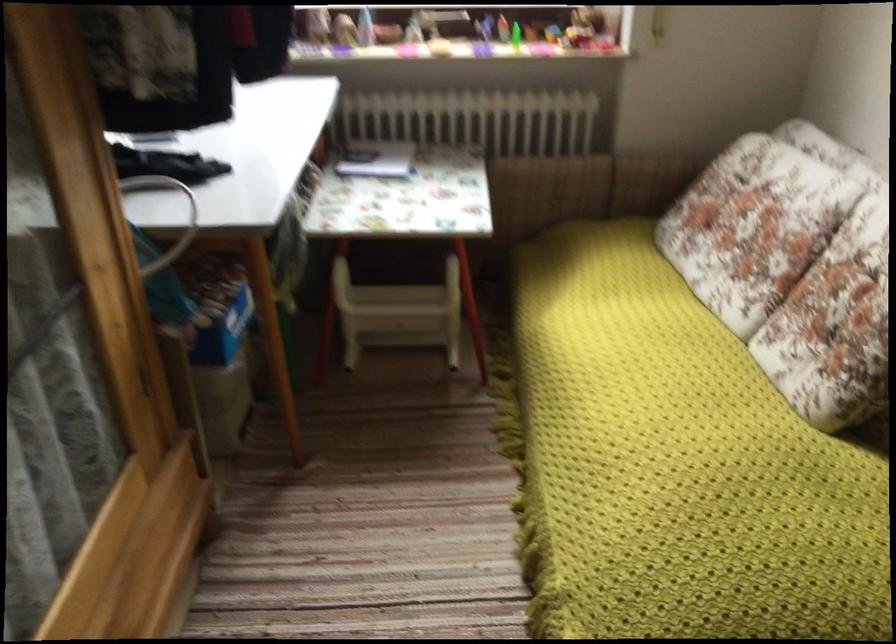
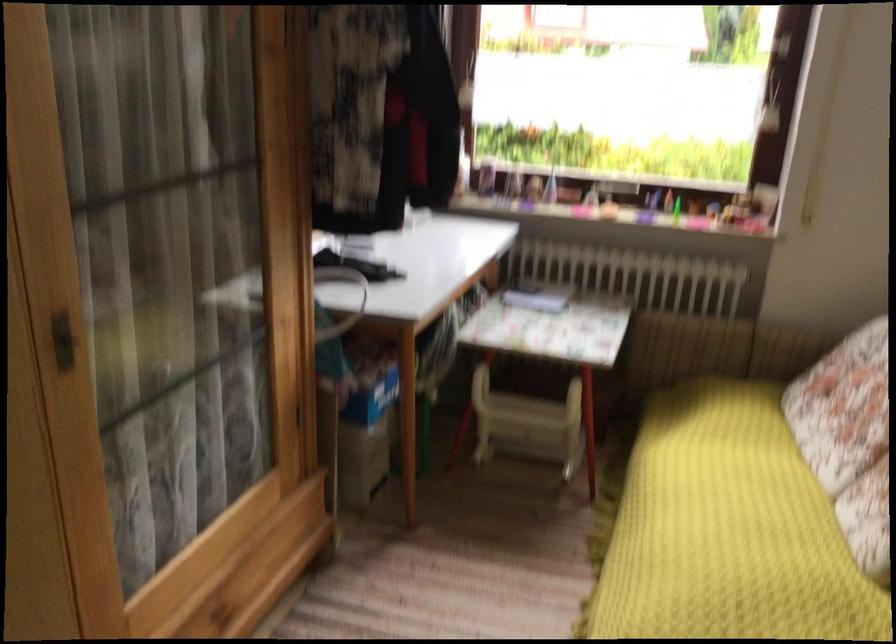
Find the pixel in the second image that matches point 665,402 in the first image.

(728, 529)